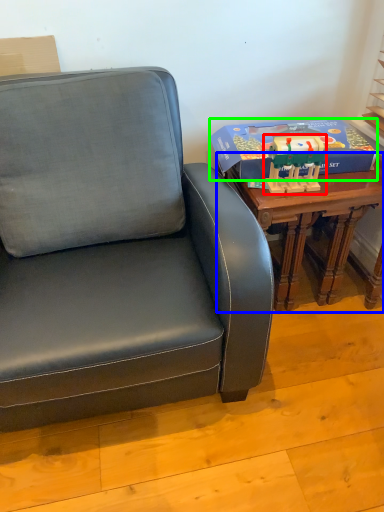
Question: Which is nearer to the toy (highlighted by a red box)? table (highlighted by a blue box) or box (highlighted by a green box).

Choices:
 (A) table
 (B) box

Answer: (B)